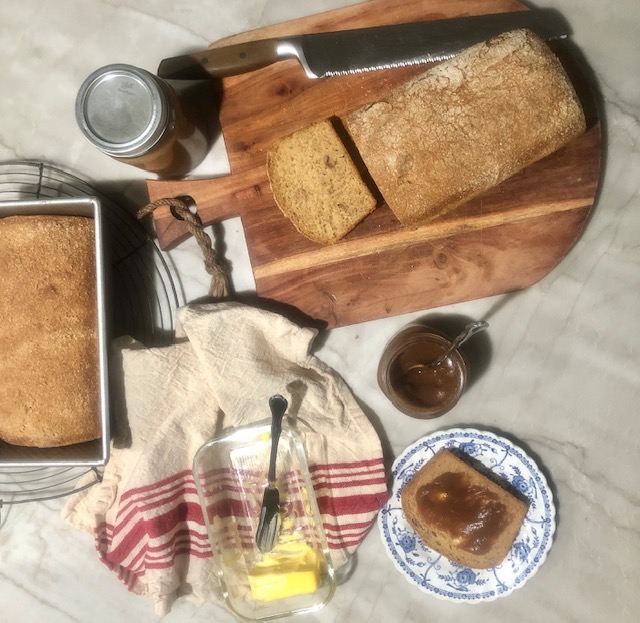
This screenshot has height=623, width=640. I want to click on glass butter dish, so click(x=200, y=465).